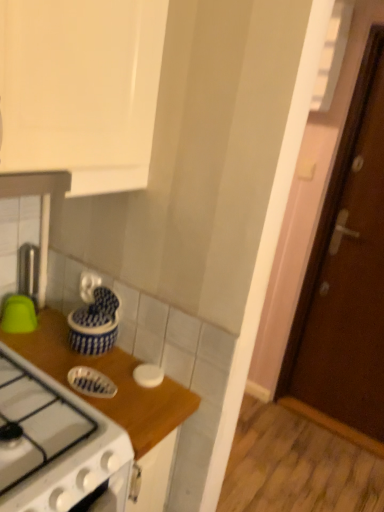
This screenshot has width=384, height=512. What are the coordinates of `vacant space to the left of blue glossy jar at center, which is counted as the second kitchen appliance, starting from the left` in the screenshot? It's located at (42, 339).